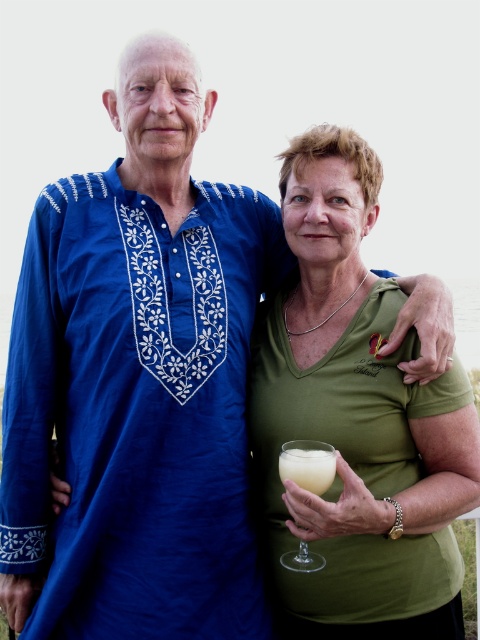
Question: Observing the image, what is the correct spatial positioning of green matte shirt at center in reference to pale yellow liquid at lower center?

Choices:
 (A) left
 (B) right

Answer: (B)

Question: Does clear glass wine glass at lower center have a lesser width compared to pale yellow liquid at lower center?

Choices:
 (A) no
 (B) yes

Answer: (A)

Question: Which object appears farthest from the camera in this image?

Choices:
 (A) green matte shirt at center
 (B) pale yellow liquid at lower center

Answer: (A)

Question: Which object is closer to the camera taking this photo?

Choices:
 (A) clear glass wine glass at lower center
 (B) green matte shirt at center
 (C) pale yellow liquid at lower center

Answer: (C)

Question: Among these objects, which one is nearest to the camera?

Choices:
 (A) clear glass wine glass at lower center
 (B) pale yellow liquid at lower center
 (C) green matte shirt at center

Answer: (B)

Question: Can you confirm if clear glass wine glass at lower center is positioned below pale yellow liquid at lower center?

Choices:
 (A) yes
 (B) no

Answer: (B)